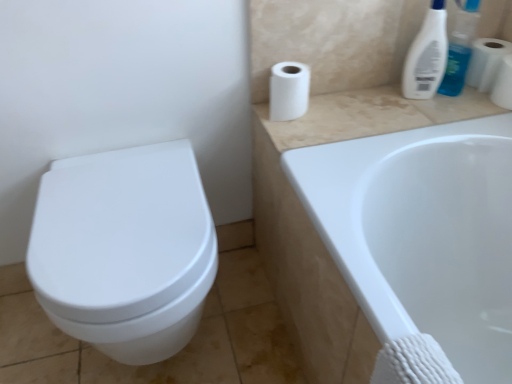
Question: Is white matte toilet paper at upper right, which is the 1th toilet paper in left-to-right order, oriented away from white glossy toilet at left?

Choices:
 (A) yes
 (B) no

Answer: (B)

Question: Is white matte toilet paper at upper right, acting as the 3th toilet paper starting from the right, wider than white glossy toilet at left?

Choices:
 (A) no
 (B) yes

Answer: (A)

Question: From a real-world perspective, is white matte toilet paper at upper right, acting as the 3th toilet paper starting from the right, on white glossy toilet at left?

Choices:
 (A) yes
 (B) no

Answer: (A)

Question: Can you confirm if white matte toilet paper at upper right, which is the 1th toilet paper in left-to-right order, is thinner than white glossy toilet at left?

Choices:
 (A) no
 (B) yes

Answer: (B)

Question: Is white matte toilet paper at upper right, acting as the 3th toilet paper starting from the right, at the right side of white glossy toilet at left?

Choices:
 (A) yes
 (B) no

Answer: (A)

Question: From a real-world perspective, is white glossy bottle at upper right positioned above or below white matte toilet paper at upper right, which ranks as the 2th toilet paper in right-to-left order?

Choices:
 (A) below
 (B) above

Answer: (B)

Question: In the image, is white glossy bottle at upper right on the left side or the right side of white matte toilet paper at upper right, the 2th toilet paper from the left?

Choices:
 (A) right
 (B) left

Answer: (B)

Question: Is white glossy bottle at upper right wider or thinner than white matte toilet paper at upper right, the 2th toilet paper from the left?

Choices:
 (A) wide
 (B) thin

Answer: (B)

Question: Is white glossy bottle at upper right inside the boundaries of white matte toilet paper at upper right, the 2th toilet paper from the left, or outside?

Choices:
 (A) inside
 (B) outside

Answer: (B)

Question: Considering the positions of white matte toilet paper at upper right, which ranks as the 2th toilet paper in right-to-left order, and white matte toilet paper at upper right, acting as the 3th toilet paper starting from the right, in the image, is white matte toilet paper at upper right, which ranks as the 2th toilet paper in right-to-left order, bigger or smaller than white matte toilet paper at upper right, acting as the 3th toilet paper starting from the right,?

Choices:
 (A) small
 (B) big

Answer: (A)

Question: From the image's perspective, is white matte toilet paper at upper right, which ranks as the 2th toilet paper in right-to-left order, above or below white matte toilet paper at upper right, which is the 1th toilet paper in left-to-right order?

Choices:
 (A) above
 (B) below

Answer: (A)

Question: Is white matte toilet paper at upper right, which ranks as the 2th toilet paper in right-to-left order, wider or thinner than white matte toilet paper at upper right, which is the 1th toilet paper in left-to-right order?

Choices:
 (A) wide
 (B) thin

Answer: (B)

Question: Considering the positions of point (496, 69) and point (303, 71), is point (496, 69) closer or farther from the camera than point (303, 71)?

Choices:
 (A) closer
 (B) farther

Answer: (B)

Question: In the image, is beige marble counter top at upper right on the left side or the right side of white matte toilet paper at upper right, marked as the 3th toilet paper in a left-to-right arrangement?

Choices:
 (A) right
 (B) left

Answer: (B)

Question: From a real-world perspective, is beige marble counter top at upper right positioned above or below white matte toilet paper at upper right, the first toilet paper viewed from the right?

Choices:
 (A) above
 (B) below

Answer: (B)